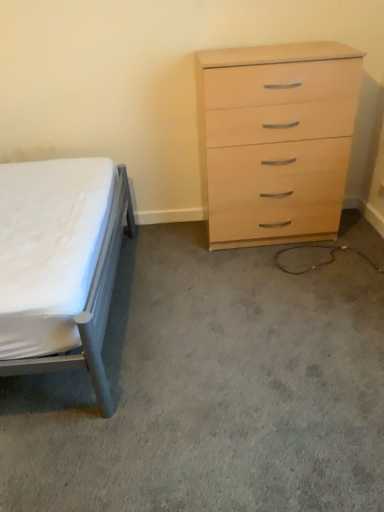
Question: Is light wood/veneer chest of drawers at right oriented towards matte gray bed at left?

Choices:
 (A) no
 (B) yes

Answer: (A)

Question: Is the position of light wood/veneer chest of drawers at right more distant than that of matte gray bed at left?

Choices:
 (A) yes
 (B) no

Answer: (A)

Question: From the image's perspective, is light wood/veneer chest of drawers at right located above matte gray bed at left?

Choices:
 (A) no
 (B) yes

Answer: (B)

Question: From a real-world perspective, does light wood/veneer chest of drawers at right stand above matte gray bed at left?

Choices:
 (A) no
 (B) yes

Answer: (B)

Question: Considering the relative positions of light wood/veneer chest of drawers at right and matte gray bed at left in the image provided, is light wood/veneer chest of drawers at right to the left of matte gray bed at left from the viewer's perspective?

Choices:
 (A) yes
 (B) no

Answer: (B)

Question: Considering the relative positions of white fabric bed at left and light wood/veneer chest of drawers at right in the image provided, is white fabric bed at left to the left or to the right of light wood/veneer chest of drawers at right?

Choices:
 (A) right
 (B) left

Answer: (B)

Question: Considering the positions of white fabric bed at left and light wood/veneer chest of drawers at right in the image, is white fabric bed at left bigger or smaller than light wood/veneer chest of drawers at right?

Choices:
 (A) big
 (B) small

Answer: (B)

Question: From the image's perspective, is white fabric bed at left located above or below light wood/veneer chest of drawers at right?

Choices:
 (A) above
 (B) below

Answer: (B)

Question: Considering the positions of white fabric bed at left and light wood/veneer chest of drawers at right in the image, is white fabric bed at left taller or shorter than light wood/veneer chest of drawers at right?

Choices:
 (A) short
 (B) tall

Answer: (A)

Question: Relative to matte gray bed at left, is white fabric bed at left in front or behind?

Choices:
 (A) front
 (B) behind

Answer: (B)

Question: From the image's perspective, is white fabric bed at left above or below matte gray bed at left?

Choices:
 (A) above
 (B) below

Answer: (B)

Question: From a real-world perspective, is white fabric bed at left physically located above or below matte gray bed at left?

Choices:
 (A) below
 (B) above

Answer: (A)

Question: Visually, is white fabric bed at left positioned to the left or to the right of matte gray bed at left?

Choices:
 (A) left
 (B) right

Answer: (B)

Question: Do you think matte gray bed at left is within white fabric bed at left, or outside of it?

Choices:
 (A) outside
 (B) inside

Answer: (A)

Question: In the image, is matte gray bed at left on the left side or the right side of white fabric bed at left?

Choices:
 (A) left
 (B) right

Answer: (A)